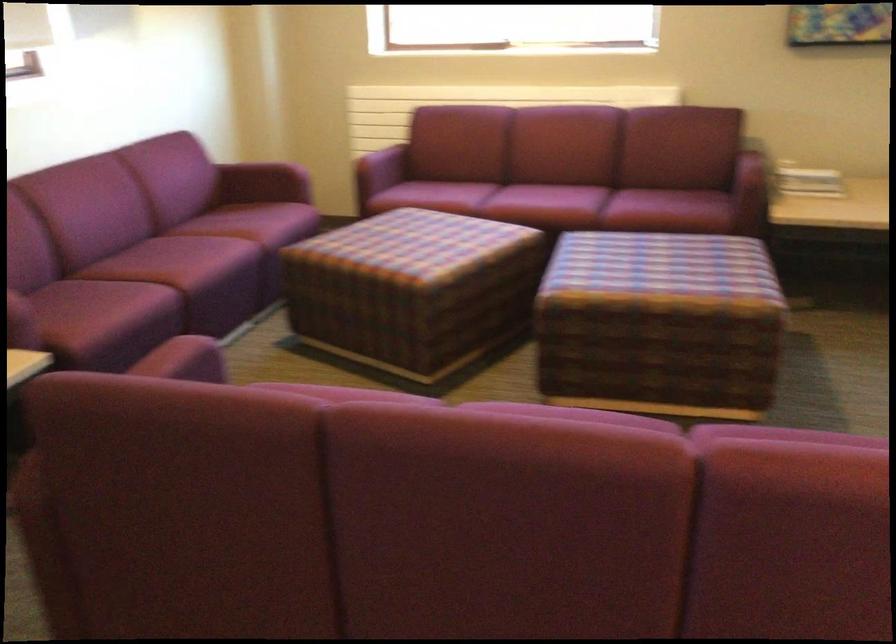
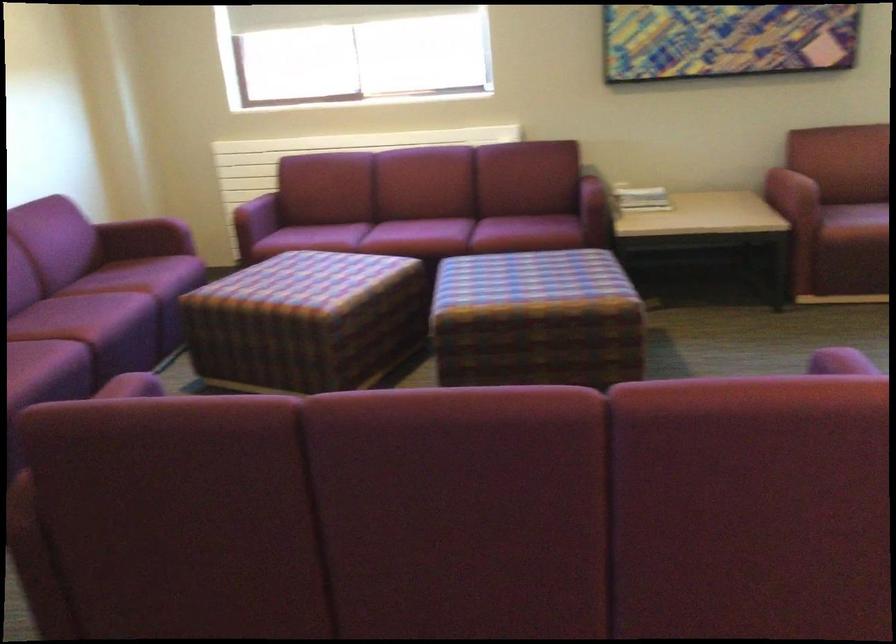
Where in the second image is the point corresponding to point 216,261 from the first image?

(116, 313)